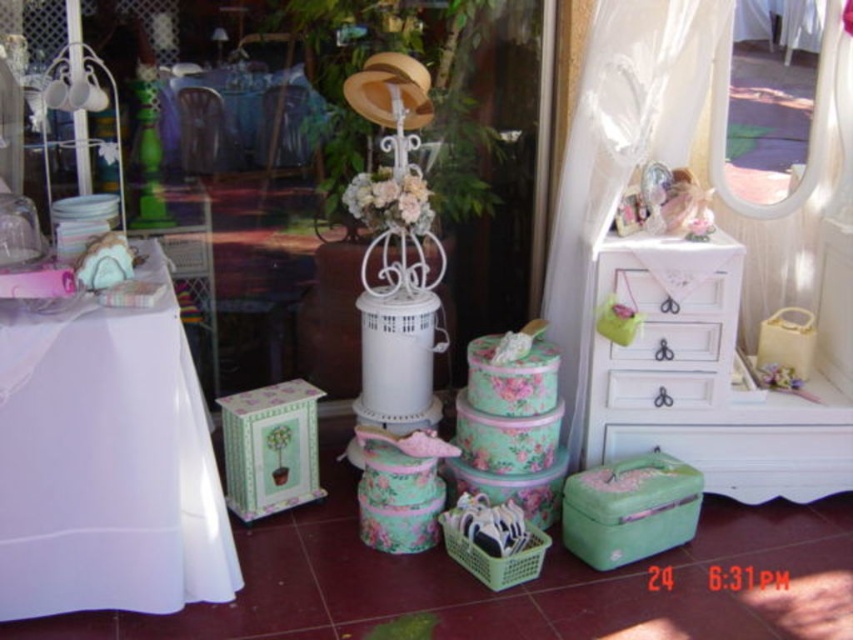
Can you confirm if white fabric table at left is positioned to the left of white painted wood drawers at right?

Indeed, white fabric table at left is positioned on the left side of white painted wood drawers at right.

Does white fabric table at left have a greater height compared to white painted wood drawers at right?

Yes.

Between point (0, 506) and point (630, 294), which one is positioned behind?

The point (630, 294) is behind.

Find the location of a particular element. This screenshot has height=640, width=853. white fabric table at left is located at coordinates (107, 461).

Which is below, white fabric table at left or white painted wood dresser at right?

white fabric table at left is lower down.

Which is behind, point (215, 477) or point (688, 257)?

Point (688, 257)

At what (x,y) coordinates should I click in order to perform the action: click on white fabric table at left. Please return your answer as a coordinate pair (x, y). Looking at the image, I should click on (107, 461).

Is clear plastic mirror at upper right above white glossy drawer at center?

Indeed, clear plastic mirror at upper right is positioned over white glossy drawer at center.

Which is more to the right, clear plastic mirror at upper right or white glossy drawer at center?

clear plastic mirror at upper right

Is point (813, 164) farther from viewer compared to point (697, 348)?

Yes, it is behind point (697, 348).

Locate an element on the screen. Image resolution: width=853 pixels, height=640 pixels. clear plastic mirror at upper right is located at coordinates (809, 131).